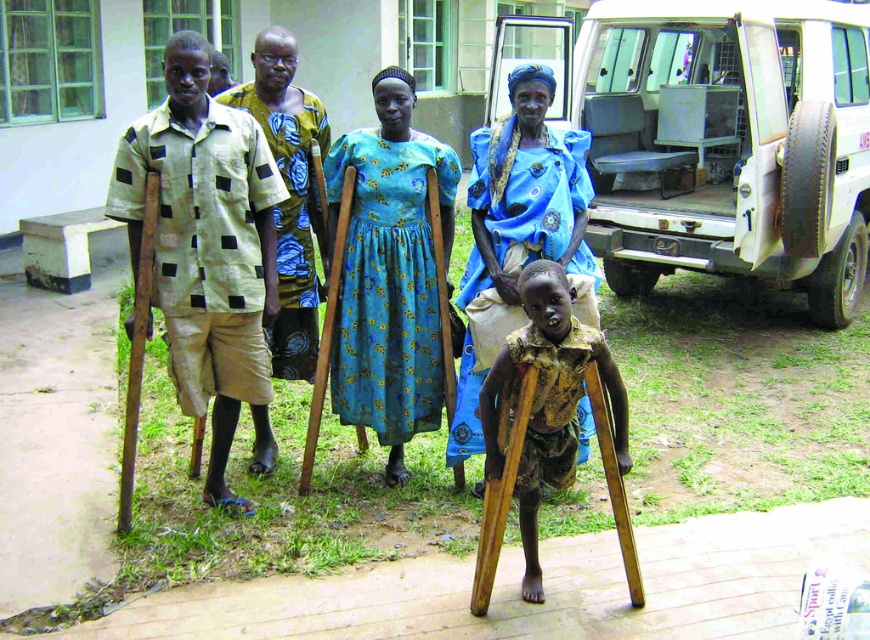
You are a photographer taking a picture of the beige fabric shirt at left and the blue fabric dress at center. Based on their positions in the image, which object is closer to the camera?

The beige fabric shirt at left is below the blue fabric dress at center, so the blue fabric dress at center is closer to the camera.